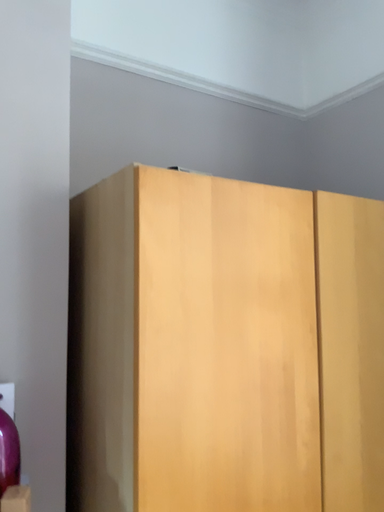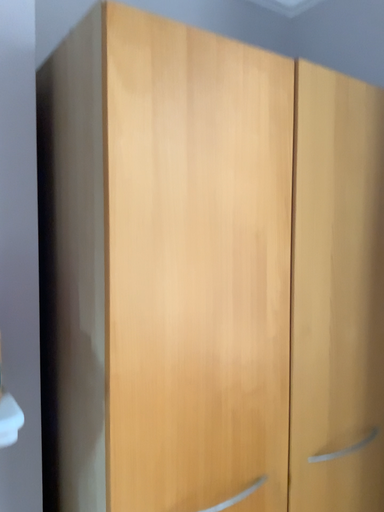
Question: How did the camera likely rotate when shooting the video?

Choices:
 (A) rotated downward
 (B) rotated upward

Answer: (A)